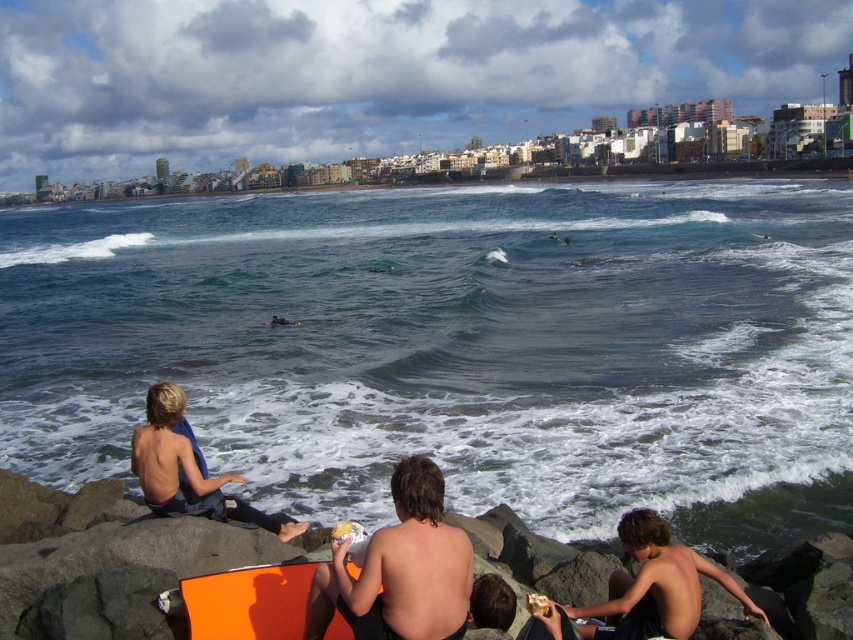
You are a swimmer who wants to reach the blue fabric surfer at lower left from the clear blue water at center. Given that you can swim at a speed of 2 meters per second, how long will it take you to reach them?

The distance between clear blue water at center and blue fabric surfer at lower left is 47.02 meters. At a swimming speed of 2 meters per second, it would take approximately 23.51 seconds to reach them.

You are a photographer trying to capture a photo of the shiny orange surfboard at center and the blue fabric surfer at lower left. Which object should you focus on first if you want to include both in your frame without moving the camera?

The shiny orange surfboard at center is not as tall as the blue fabric surfer at lower left, so you should focus on the blue fabric surfer at lower left first to ensure it fits in the frame since it is taller.